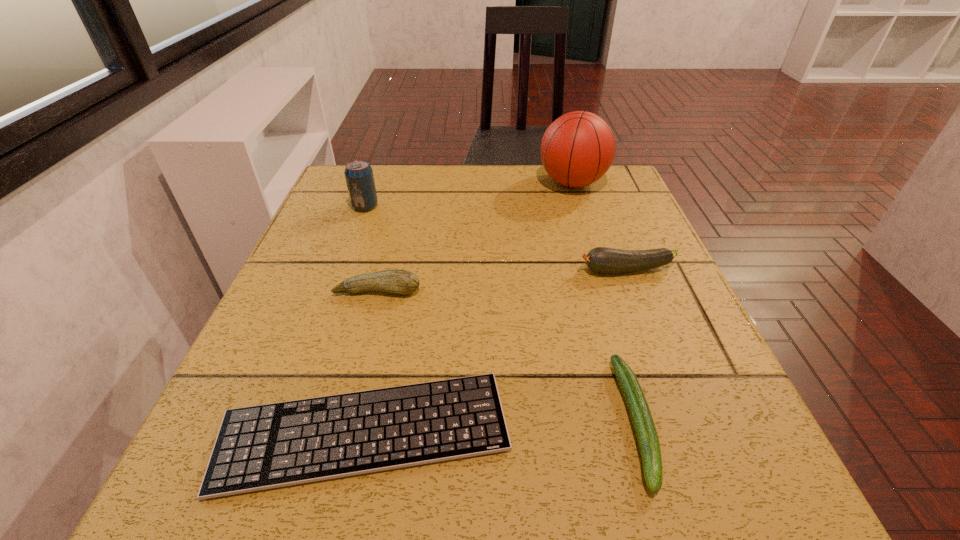
You are a GUI agent. You are given a task and a screenshot of the screen. Output one action in this format:
    pyautogui.click(x=<x>, y=<y>)
    Task: Click on the vacant point at the right edge
    
    Given the screenshot: What is the action you would take?
    pyautogui.click(x=636, y=219)

The height and width of the screenshot is (540, 960). Find the location of `free space between the shortest object and the farthest zucchini`. free space between the shortest object and the farthest zucchini is located at coordinates (495, 351).

At what (x,y) coordinates should I click in order to perform the action: click on free space between the pop soda and the shortest zucchini. Please return your answer as a coordinate pair (x, y). The image size is (960, 540). Looking at the image, I should click on (501, 314).

You are a GUI agent. You are given a task and a screenshot of the screen. Output one action in this format:
    pyautogui.click(x=<x>, y=<y>)
    Task: Click on the vacant area that lies between the third farthest object and the shortest object
    The width and height of the screenshot is (960, 540).
    Given the screenshot: What is the action you would take?
    pyautogui.click(x=495, y=351)

Locate an element on the screen. Image resolution: width=960 pixels, height=540 pixels. vacant space in between the third nearest object and the tallest object is located at coordinates (475, 237).

Where is `free space between the farthest zucchini and the shortest object`? Image resolution: width=960 pixels, height=540 pixels. free space between the farthest zucchini and the shortest object is located at coordinates (495, 351).

Identify the location of free space between the fourth nearest object and the shortest object. The width and height of the screenshot is (960, 540). (495, 351).

At what (x,y) coordinates should I click in order to perform the action: click on vacant space in between the farthest zucchini and the third nearest object. Please return your answer as a coordinate pair (x, y). Looking at the image, I should click on (502, 281).

Identify the location of free spot between the farthest zucchini and the second shortest object. The height and width of the screenshot is (540, 960). (631, 346).

Point out which object is positioned as the fifth nearest to the nearest zucchini. Please provide its 2D coordinates. Your answer should be formatted as a tuple, i.e. [(x, y)], where the tuple contains the x and y coordinates of a point satisfying the conditions above.

[(359, 177)]